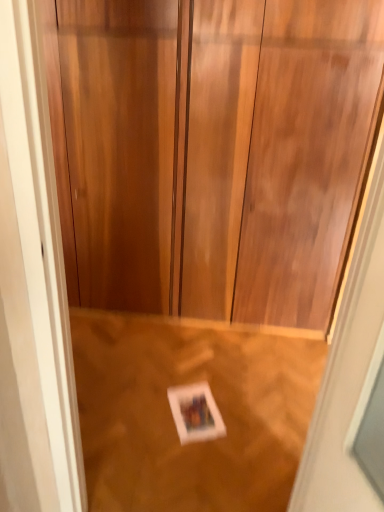
At what (x,y) coordinates should I click in order to perform the action: click on vacant location behind white paper at center. Please return your answer as a coordinate pair (x, y). The image size is (384, 512). Looking at the image, I should click on (192, 371).